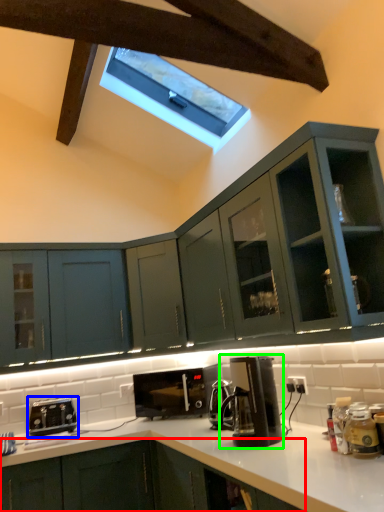
Question: Which object is positioned closest to cabinetry (highlighted by a red box)? Select from toaster (highlighted by a blue box) and kitchen appliance (highlighted by a green box).

Choices:
 (A) toaster
 (B) kitchen appliance

Answer: (B)